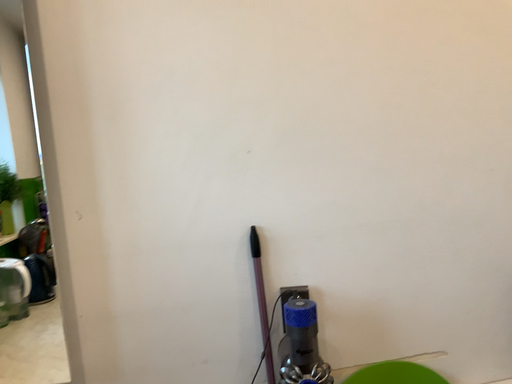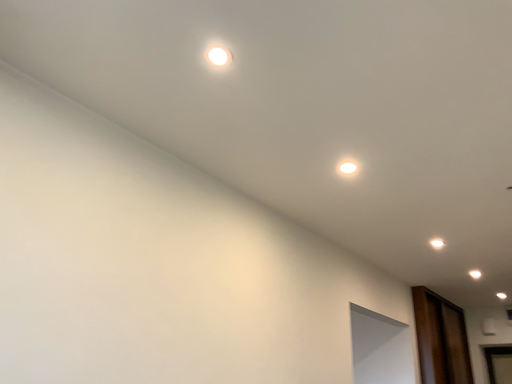
Question: Which way did the camera rotate in the video?

Choices:
 (A) rotated right
 (B) rotated left

Answer: (A)